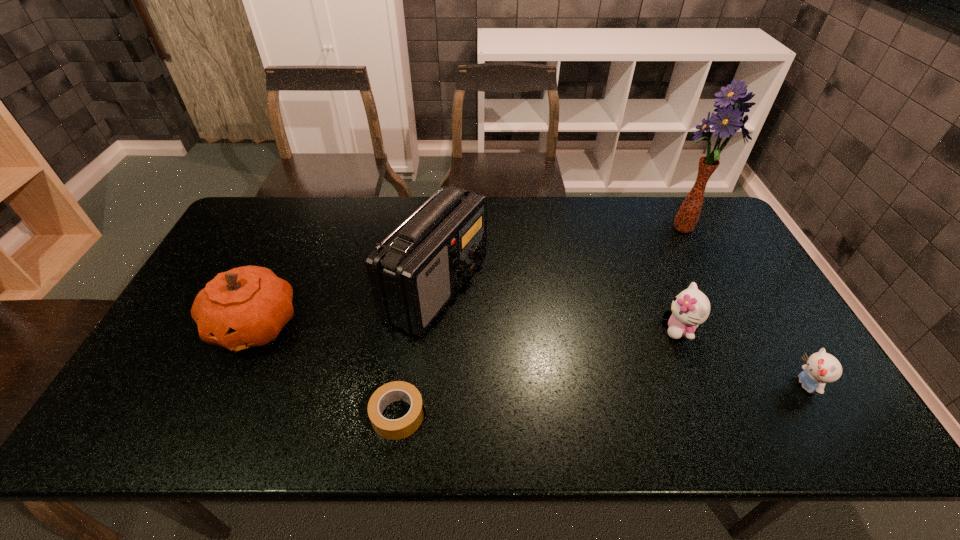
Where is `free space between the taller kitten and the tallest object`? Image resolution: width=960 pixels, height=540 pixels. free space between the taller kitten and the tallest object is located at coordinates (681, 279).

You are a GUI agent. You are given a task and a screenshot of the screen. Output one action in this format:
    pyautogui.click(x=<x>, y=<y>)
    Task: Click on the free area in between the duct tape and the right kitten
    This screenshot has width=960, height=540.
    Given the screenshot: What is the action you would take?
    pyautogui.click(x=603, y=400)

Find the location of `unoccupied area between the nearer kitten and the third shortest object`. unoccupied area between the nearer kitten and the third shortest object is located at coordinates (743, 357).

Where is `unoccupied area between the tallest object and the radio receiver`? The width and height of the screenshot is (960, 540). unoccupied area between the tallest object and the radio receiver is located at coordinates (560, 258).

Locate an element on the screen. This screenshot has width=960, height=540. free area in between the right kitten and the pumpkin is located at coordinates (531, 355).

Find the location of `vacant region between the fourth tallest object and the shortest object`. vacant region between the fourth tallest object and the shortest object is located at coordinates (540, 372).

Where is `vacant area that lies between the shorter kitten and the tallest object`? vacant area that lies between the shorter kitten and the tallest object is located at coordinates (744, 307).

You are a GUI agent. You are given a task and a screenshot of the screen. Output one action in this format:
    pyautogui.click(x=<x>, y=<y>)
    Task: Click on the unoccupied area between the shorter kitten and the flower arrangement
    The image size is (960, 540).
    Given the screenshot: What is the action you would take?
    pyautogui.click(x=744, y=307)

The height and width of the screenshot is (540, 960). I want to click on the third closest object to the fifth shortest object, so click(x=690, y=308).

Identify which object is located as the third nearest to the farther kitten. Please provide its 2D coordinates. Your answer should be formatted as a tuple, i.e. [(x, y)], where the tuple contains the x and y coordinates of a point satisfying the conditions above.

[(415, 272)]